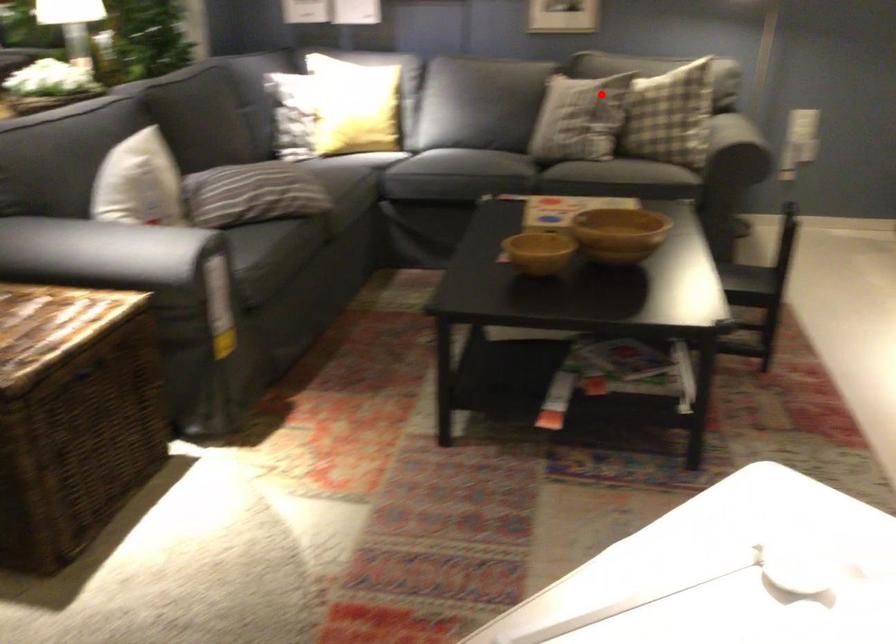
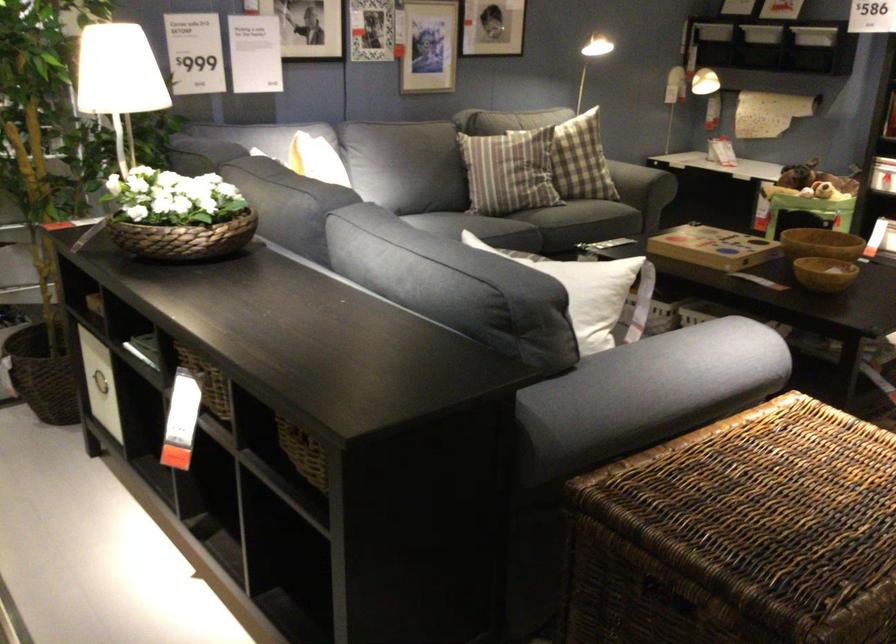
Where in the second image is the point corresponding to the highlighted location from the first image?

(581, 160)